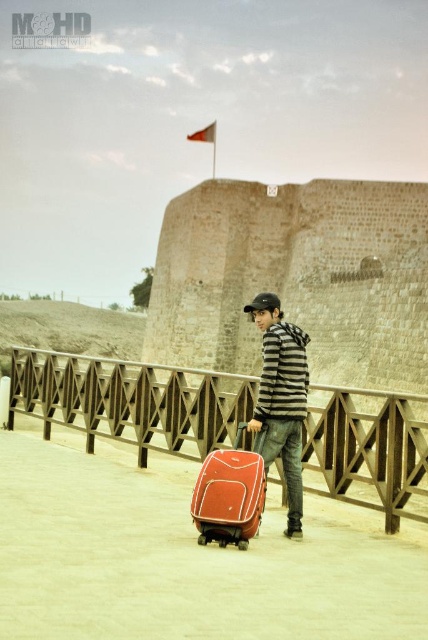
You are a traveler carrying the matte red suitcase at center. You want to place it on the wooden rail at center to rest for a moment. Is this possible based on their positions?

The wooden rail at center is to the left of the matte red suitcase at center, so you can place the matte red suitcase at center onto the wooden rail at center since it is adjacent and accessible.

The striped hoodie at center is located at what coordinates?

The striped hoodie at center is located at coordinates (282, 397).